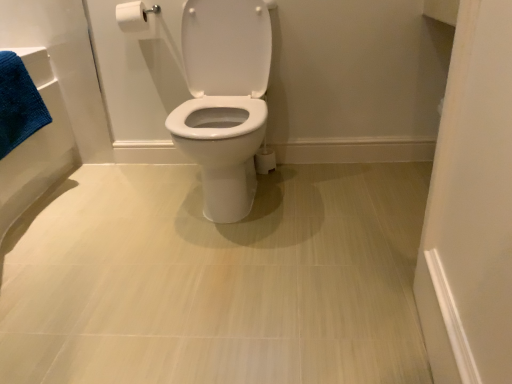
Question: Is white glossy toilet at center to the left of white matte toilet paper at upper left from the viewer's perspective?

Choices:
 (A) no
 (B) yes

Answer: (A)

Question: Does white glossy toilet at center have a larger size compared to white matte toilet paper at upper left?

Choices:
 (A) yes
 (B) no

Answer: (A)

Question: From the image's perspective, would you say white glossy toilet at center is positioned over white matte toilet paper at upper left?

Choices:
 (A) no
 (B) yes

Answer: (A)

Question: Can you confirm if white glossy toilet at center is positioned to the right of white matte toilet paper at upper left?

Choices:
 (A) yes
 (B) no

Answer: (A)

Question: From a real-world perspective, is white glossy toilet at center on white matte toilet paper at upper left?

Choices:
 (A) no
 (B) yes

Answer: (A)

Question: Is white glossy toilet at center completely or partially outside of white matte toilet paper at upper left?

Choices:
 (A) yes
 (B) no

Answer: (A)

Question: Does white matte toilet paper at upper left lie in front of white glossy toilet at center?

Choices:
 (A) no
 (B) yes

Answer: (A)

Question: Considering the relative positions of white matte toilet paper at upper left and white glossy toilet at center in the image provided, is white matte toilet paper at upper left to the left of white glossy toilet at center from the viewer's perspective?

Choices:
 (A) yes
 (B) no

Answer: (A)

Question: Are white matte toilet paper at upper left and white glossy toilet at center far apart?

Choices:
 (A) no
 (B) yes

Answer: (B)

Question: Does white matte toilet paper at upper left lie behind white glossy toilet at center?

Choices:
 (A) yes
 (B) no

Answer: (A)

Question: Is white matte toilet paper at upper left placed right next to white glossy toilet at center?

Choices:
 (A) yes
 (B) no

Answer: (B)

Question: Is white matte toilet paper at upper left oriented towards white glossy toilet at center?

Choices:
 (A) no
 (B) yes

Answer: (A)

Question: From the image's perspective, is white glossy toilet at center on top of blue cotton bath towel at left?

Choices:
 (A) no
 (B) yes

Answer: (A)